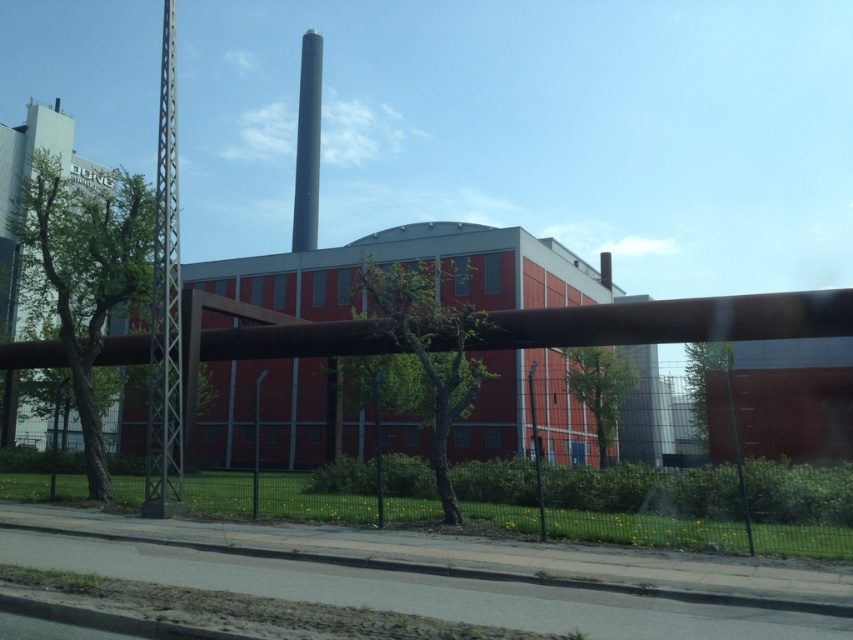
Which is above, green grass at lower center or smooth gray chimney at upper center?

smooth gray chimney at upper center

Is point (431, 499) in front of point (300, 186)?

That is True.

Is point (827, 468) closer to viewer compared to point (316, 241)?

That is True.

This screenshot has width=853, height=640. I want to click on green grass at lower center, so click(646, 506).